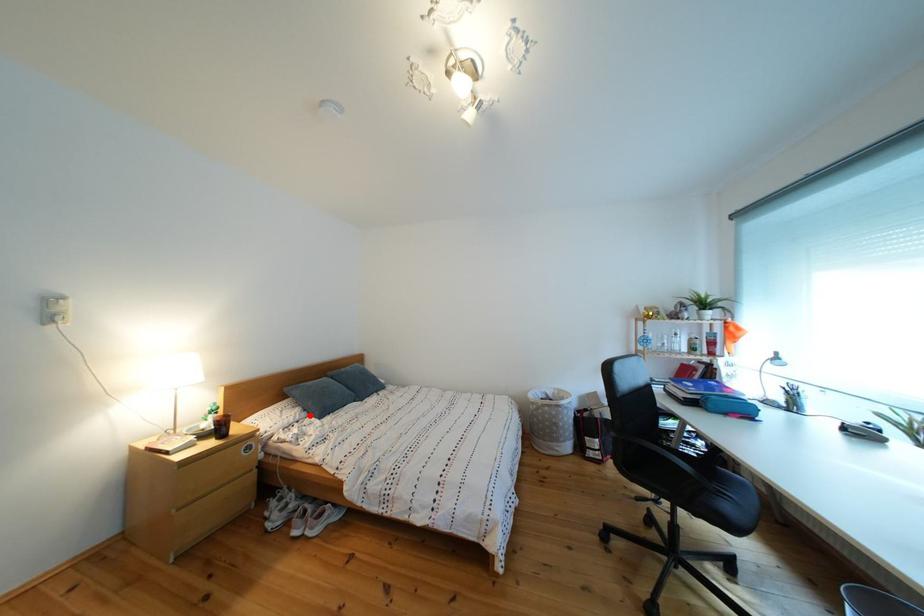
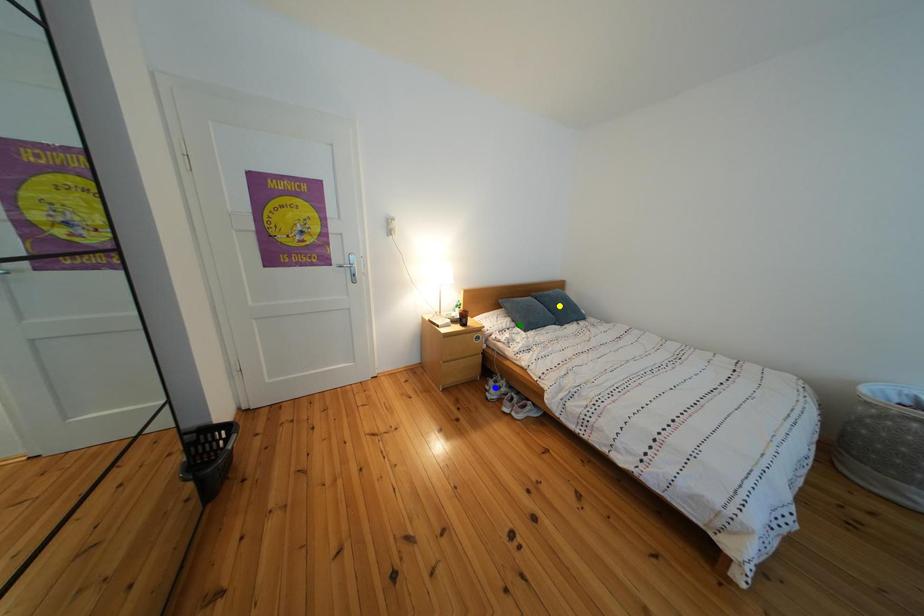
Question: I am providing you with two images of the same scene from different viewpoints. A red point is marked on the first image. You are given multiple points on the second image. Which mark in image 2 goes with the point in image 1?

Choices:
 (A) green point
 (B) yellow point
 (C) blue point

Answer: (A)